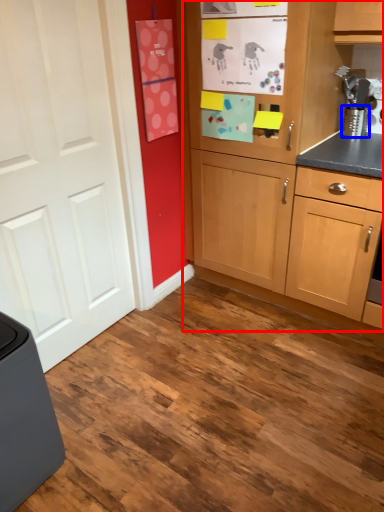
Question: Which object is further to the camera taking this photo, cabinetry (highlighted by a red box) or appliance (highlighted by a blue box)?

Choices:
 (A) cabinetry
 (B) appliance

Answer: (B)